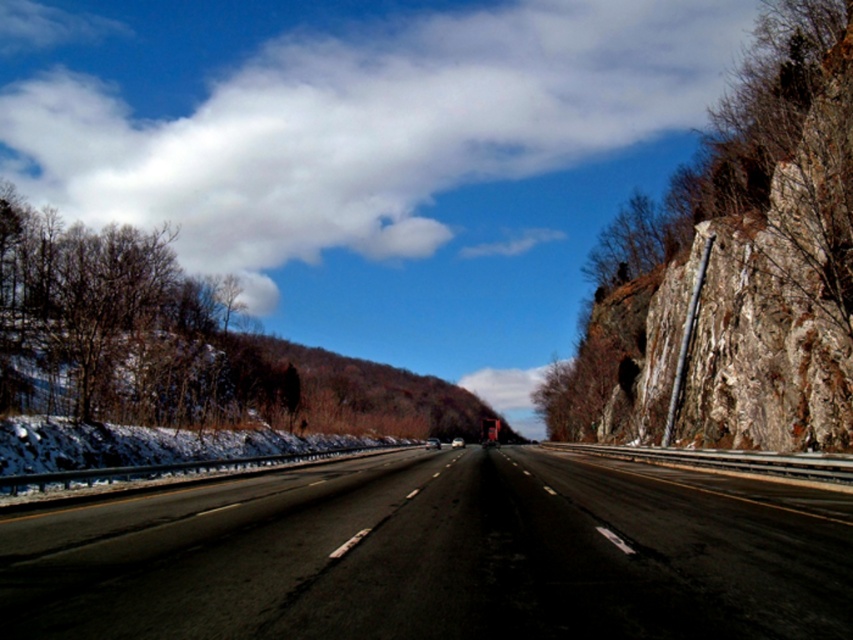
Which is in front, point (109, 627) or point (90, 262)?

Point (109, 627) is in front.

What do you see at coordinates (433, 557) in the screenshot?
I see `black asphalt highway at center` at bounding box center [433, 557].

Describe the element at coordinates (433, 557) in the screenshot. The height and width of the screenshot is (640, 853). I see `black asphalt highway at center` at that location.

This screenshot has width=853, height=640. I want to click on black asphalt highway at center, so click(x=433, y=557).